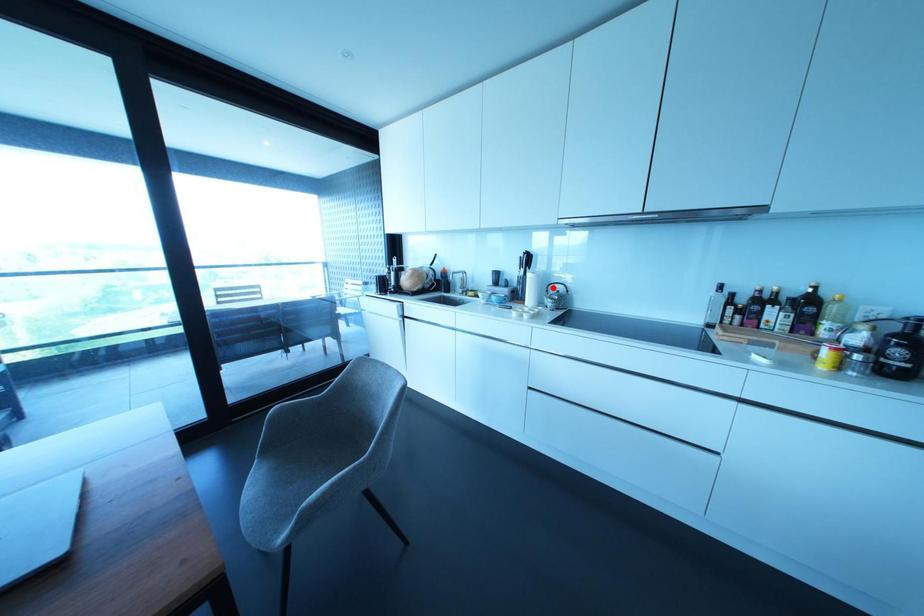
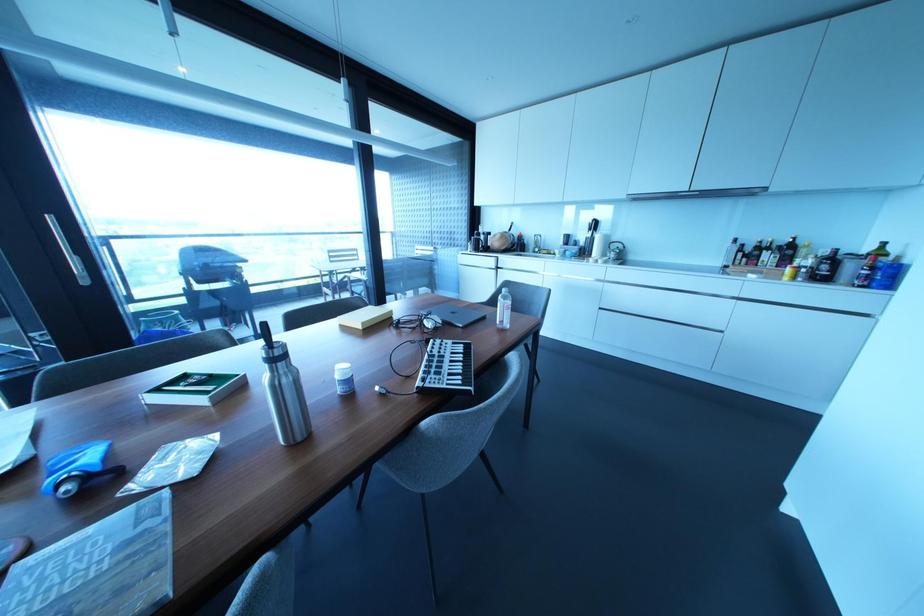
In the second image, find the point that corresponds to the highlighted location in the first image.

(614, 245)